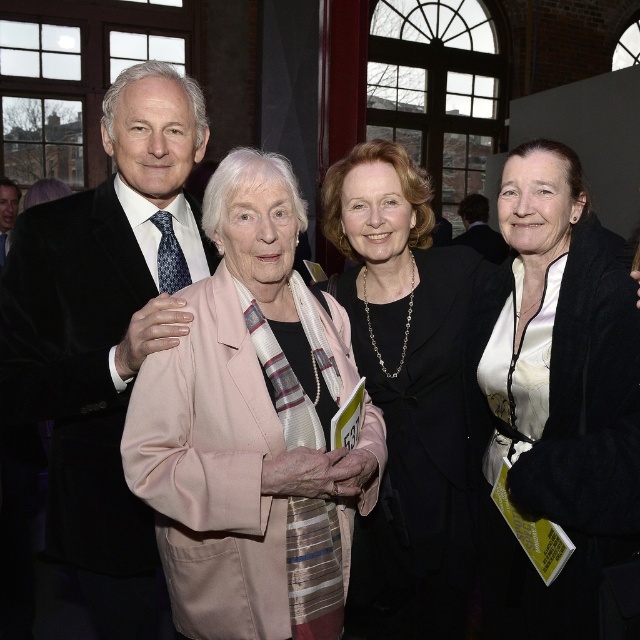
Question: Is black satin blazer at center to the right of matte black suit at left from the viewer's perspective?

Choices:
 (A) no
 (B) yes

Answer: (B)

Question: Does velvet black suit at upper left appear on the right side of matte black suit at left?

Choices:
 (A) yes
 (B) no

Answer: (A)

Question: Can you confirm if black satin blazer at center is positioned below matte black suit at upper left?

Choices:
 (A) yes
 (B) no

Answer: (A)

Question: Which object is the closest to the matte black suit at left?

Choices:
 (A) matte black suit at upper left
 (B) black satin blazer at center
 (C) white silk blouse at center

Answer: (B)

Question: Which point is closer to the camera?

Choices:
 (A) black satin blazer at center
 (B) velvet black suit at upper left
 (C) pink satin blazer at center

Answer: (C)

Question: Which of the following is the farthest from the observer?

Choices:
 (A) (4, 192)
 (B) (500, 330)
 (C) (369, 579)

Answer: (A)